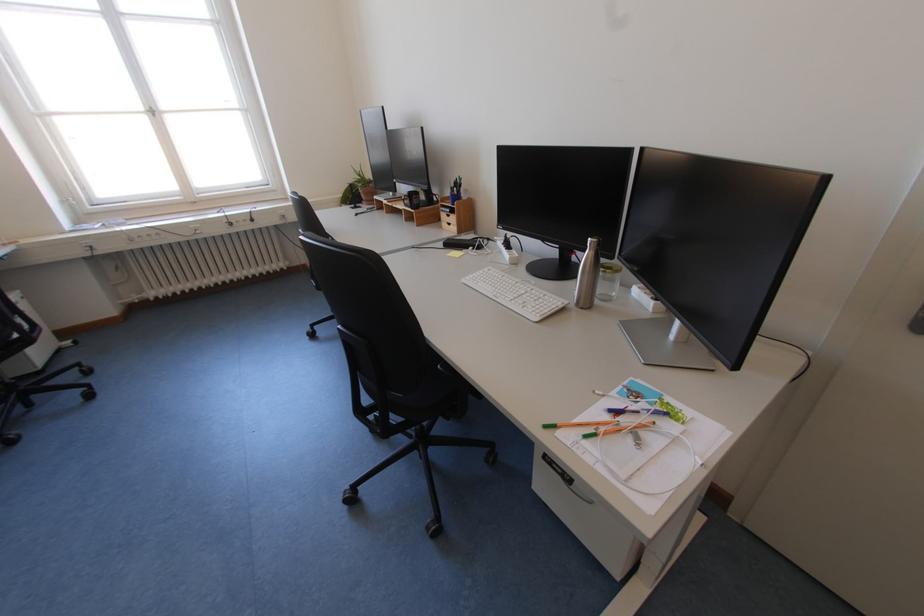
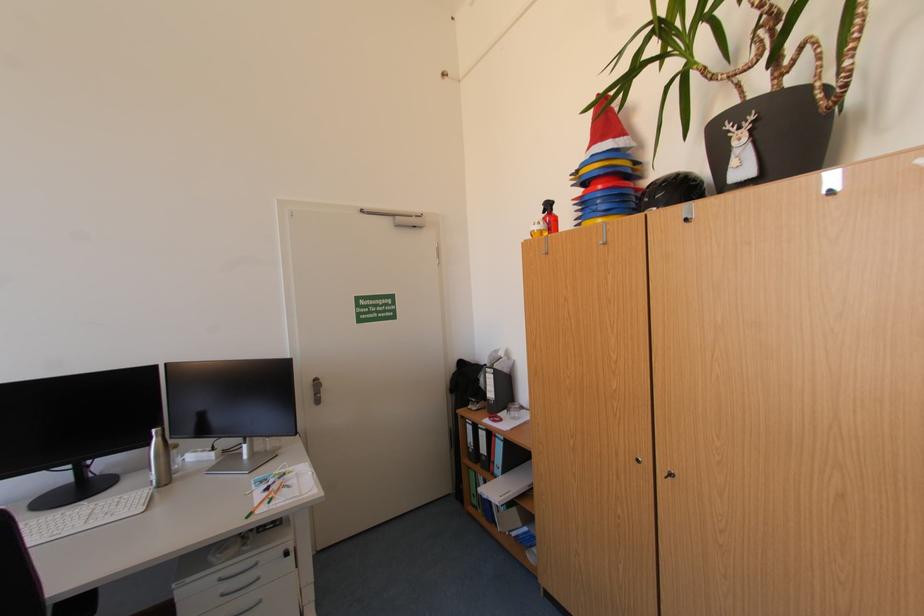
Locate, in the second image, the point that corresponds to (638,152) in the first image.

(164, 368)